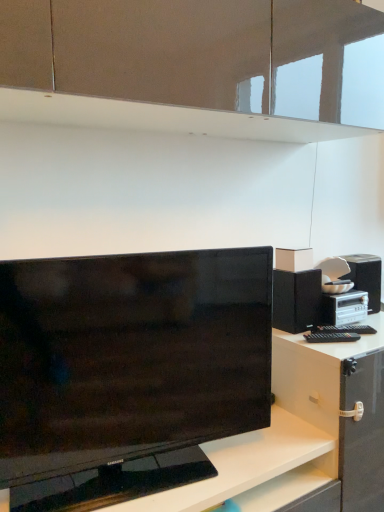
Question: Is black matte speaker at right wider or thinner than black glossy tv at center?

Choices:
 (A) thin
 (B) wide

Answer: (B)

Question: From the image's perspective, is black matte speaker at right above or below black glossy tv at center?

Choices:
 (A) above
 (B) below

Answer: (A)

Question: Considering the positions of point (306, 316) and point (329, 483), is point (306, 316) closer or farther from the camera than point (329, 483)?

Choices:
 (A) farther
 (B) closer

Answer: (A)

Question: From the image's perspective, is black glossy tv at center located above or below black matte speaker at right?

Choices:
 (A) below
 (B) above

Answer: (A)

Question: Is black glossy tv at center in front of or behind black matte speaker at right in the image?

Choices:
 (A) front
 (B) behind

Answer: (A)

Question: Considering the positions of black glossy tv at center and black matte speaker at right in the image, is black glossy tv at center bigger or smaller than black matte speaker at right?

Choices:
 (A) big
 (B) small

Answer: (A)

Question: Would you say black glossy tv at center is to the left or to the right of black matte speaker at right in the picture?

Choices:
 (A) left
 (B) right

Answer: (A)